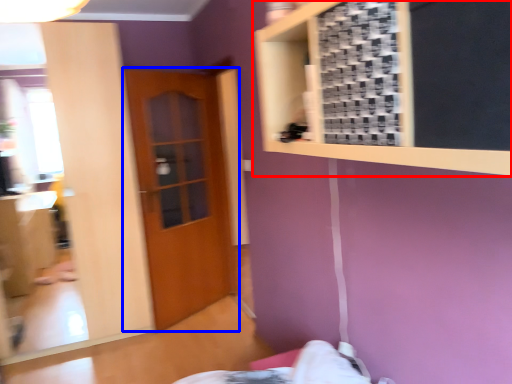
Question: Which object appears farthest to the camera in this image, bulletin board (highlighted by a red box) or door (highlighted by a blue box)?

Choices:
 (A) bulletin board
 (B) door

Answer: (B)